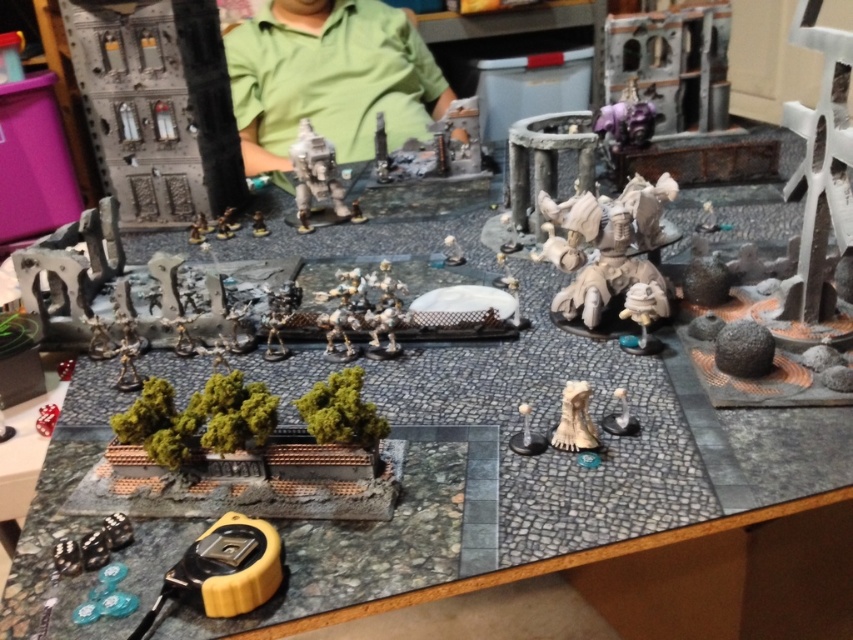
Question: Can you confirm if purple metallic armor at upper right is thinner than metallic silver miniature at center-left?

Choices:
 (A) yes
 (B) no

Answer: (B)

Question: Is the position of white plastic figurine at center more distant than that of white matte figurine at center?

Choices:
 (A) yes
 (B) no

Answer: (B)

Question: Can you confirm if yellow rubber tape measure at lower left is positioned to the right of white matte miniature at center?

Choices:
 (A) yes
 (B) no

Answer: (B)

Question: Which point appears closest to the camera in this image?

Choices:
 (A) pos(233,228)
 (B) pos(659,346)
 (C) pos(628,413)

Answer: (C)

Question: Which object is positioned farthest from the white plastic skull at center?

Choices:
 (A) green matte shirt at center
 (B) purple metallic armor at upper right
 (C) metallic silver miniature at center-left
 (D) white matte miniature at center

Answer: (A)

Question: Which point is farther to the camera?

Choices:
 (A) matte white figurine at center-right
 (B) green matte shirt at center
 (C) white plastic skull at center
 (D) purple metallic armor at upper right

Answer: (B)